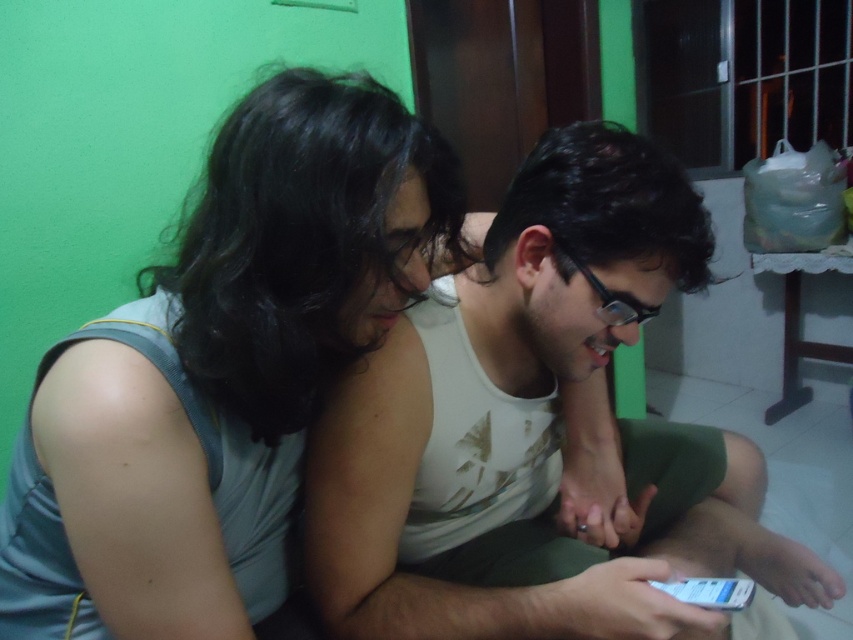
Who is more distant from viewer, (285, 528) or (375, 374)?

The point (285, 528) is more distant.

Looking at this image, can you confirm if gray fabric shirt at left is smaller than white matte tank top at center?

Yes, gray fabric shirt at left is smaller than white matte tank top at center.

In order to click on gray fabric shirt at left in this screenshot , I will do `click(222, 371)`.